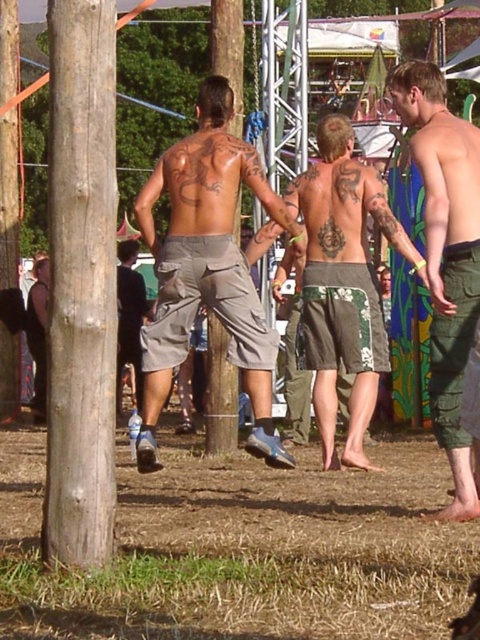
Based on the photo, how far apart are light brown wood pole at left and green camouflage shorts at center?

light brown wood pole at left is 9.15 feet from green camouflage shorts at center.

Image resolution: width=480 pixels, height=640 pixels. I want to click on light brown wood pole at left, so click(x=81, y=284).

Image resolution: width=480 pixels, height=640 pixels. I want to click on light brown wood pole at left, so click(81, 284).

Locate an element on the screen. light brown wood pole at left is located at coordinates (81, 284).

Who is lower down, brown dry grass at lower center or green camouflage shorts at center?

brown dry grass at lower center is lower down.

Can you confirm if brown dry grass at lower center is thinner than green camouflage shorts at center?

No, brown dry grass at lower center is not thinner than green camouflage shorts at center.

Describe the element at coordinates (243, 550) in the screenshot. The width and height of the screenshot is (480, 640). I see `brown dry grass at lower center` at that location.

Locate an element on the screen. The height and width of the screenshot is (640, 480). brown dry grass at lower center is located at coordinates (243, 550).

Between point (184, 582) and point (56, 227), which one is positioned in front?

Point (184, 582)

Which is behind, point (231, 467) or point (67, 461)?

The point (231, 467) is more distant.

What do you see at coordinates (243, 550) in the screenshot? This screenshot has width=480, height=640. I see `brown dry grass at lower center` at bounding box center [243, 550].

The height and width of the screenshot is (640, 480). Find the location of `brown dry grass at lower center`. brown dry grass at lower center is located at coordinates (243, 550).